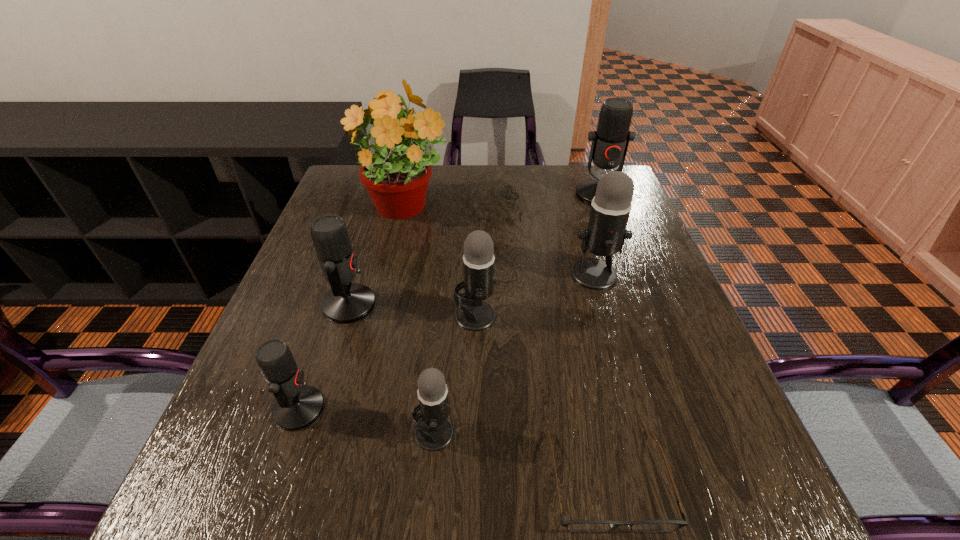
Where is `the tallest object`? Image resolution: width=960 pixels, height=540 pixels. the tallest object is located at coordinates (397, 182).

At what (x,y) coordinates should I click in order to perform the action: click on flowerpot. Please return your answer as a coordinate pair (x, y). Looking at the image, I should click on (397, 182).

You are a GUI agent. You are given a task and a screenshot of the screen. Output one action in this format:
    pyautogui.click(x=<x>, y=<y>)
    Task: Click on the farthest red microphone
    This screenshot has height=540, width=960.
    Given the screenshot: What is the action you would take?
    pyautogui.click(x=610, y=141)

In order to click on the biggest red microphone in this screenshot , I will do `click(610, 141)`.

I want to click on the farthest gray microphone, so click(x=606, y=233).

You are a GUI agent. You are given a task and a screenshot of the screen. Output one action in this format:
    pyautogui.click(x=<x>, y=<y>)
    Task: Click on the biggest gray microphone
    
    Given the screenshot: What is the action you would take?
    pyautogui.click(x=606, y=233)

Locate an element on the screen. the second nearest red microphone is located at coordinates (347, 302).

Where is `the second smallest gray microphone`? The image size is (960, 540). the second smallest gray microphone is located at coordinates (473, 314).

The image size is (960, 540). In order to click on the smallest red microphone in this screenshot , I will do click(x=298, y=405).

Locate an element on the screen. The height and width of the screenshot is (540, 960). the nearest gray microphone is located at coordinates (434, 432).